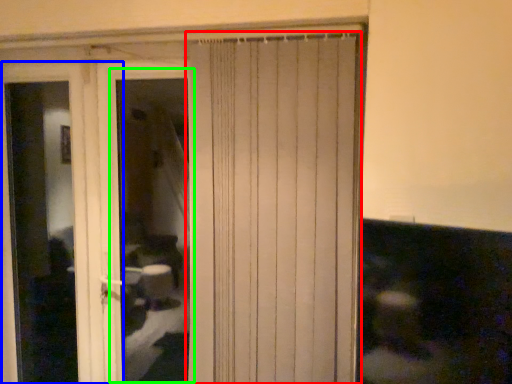
Question: Which object is positioned closest to curtain (highlighted by a red box)? Select from screen door (highlighted by a blue box) and window (highlighted by a green box).

Choices:
 (A) screen door
 (B) window

Answer: (A)